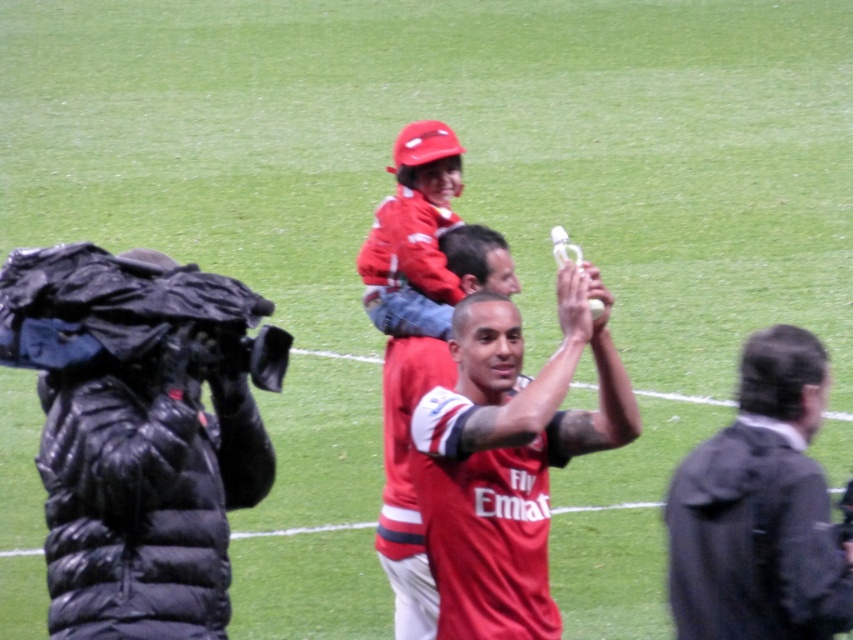
You are a photographer trying to capture a closeup shot of the matte red jersey at center while also including the black puffer jacket at left in the frame. Given their sizes, which object should you position closer to the camera to ensure both are visible without cropping?

Since the black puffer jacket at left is wider than the matte red jersey at center, you should position the black puffer jacket at left closer to the camera to ensure both objects fit within the frame while maintaining visibility.

You are standing at the origin point of the image. The point with coordinates (759, 509) is marked. Which object is located at that point?

The point at coordinates (759, 509) marks the dark gray jacket at right.